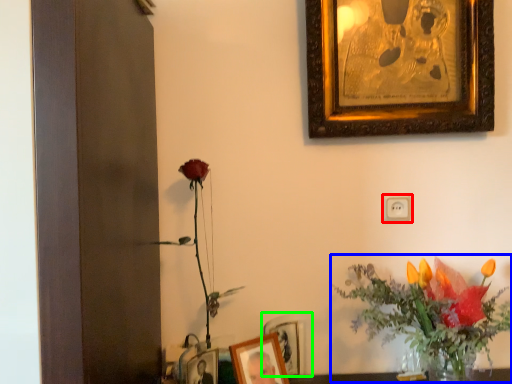
Question: Which is nearer to the electric outlet (highlighted by a red box)? floral arrangement (highlighted by a blue box) or picture frame (highlighted by a green box).

Choices:
 (A) floral arrangement
 (B) picture frame

Answer: (A)